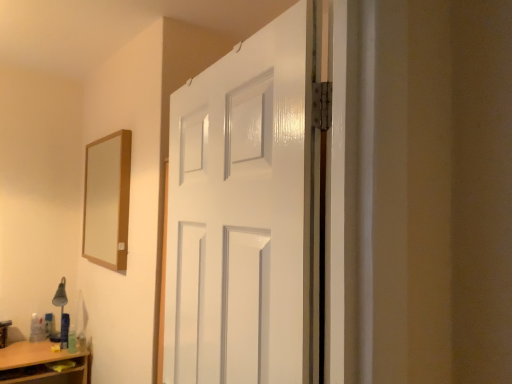
What do you see at coordinates (62, 312) in the screenshot? Image resolution: width=512 pixels, height=384 pixels. I see `matte silver table lamp at lower left` at bounding box center [62, 312].

Describe the element at coordinates (106, 200) in the screenshot. The height and width of the screenshot is (384, 512). I see `wooden-framed mirror at upper left` at that location.

Find the location of a particular element. The width and height of the screenshot is (512, 384). matte silver table lamp at lower left is located at coordinates (62, 312).

Could you tell me if matte silver table lamp at lower left is facing wooden-framed mirror at upper left?

No, matte silver table lamp at lower left is not turned towards wooden-framed mirror at upper left.

Does matte silver table lamp at lower left have a lesser width compared to wooden-framed mirror at upper left?

Incorrect, the width of matte silver table lamp at lower left is not less than that of wooden-framed mirror at upper left.

Locate an element on the screen. The width and height of the screenshot is (512, 384). mirror on the right of matte silver table lamp at lower left is located at coordinates (106, 200).

Can you tell me how much matte silver table lamp at lower left and wooden-framed mirror at upper left differ in facing direction?

They differ by 79.1 degrees in their facing directions.

Is white glossy door at center positioned with its back to wooden-framed mirror at upper left?

No.

Locate an element on the screen. The image size is (512, 384). mirror above the white glossy door at center (from the image's perspective) is located at coordinates (106, 200).

Can you confirm if white glossy door at center is smaller than wooden-framed mirror at upper left?

Actually, white glossy door at center might be larger than wooden-framed mirror at upper left.

How different are the orientations of wooden-framed mirror at upper left and matte silver table lamp at lower left in degrees?

The angle between the facing direction of wooden-framed mirror at upper left and the facing direction of matte silver table lamp at lower left is 79.1 degrees.

Could you tell me if wooden-framed mirror at upper left is turned towards matte silver table lamp at lower left?

No, wooden-framed mirror at upper left does not turn towards matte silver table lamp at lower left.

Considering the sizes of objects wooden-framed mirror at upper left and matte silver table lamp at lower left in the image provided, who is taller, wooden-framed mirror at upper left or matte silver table lamp at lower left?

With more height is wooden-framed mirror at upper left.

Is wooden-framed mirror at upper left wider or thinner than matte silver table lamp at lower left?

wooden-framed mirror at upper left is thinner than matte silver table lamp at lower left.

Is white glossy door at center bigger than matte silver table lamp at lower left?

Yes.

Considering the relative positions of white glossy door at center and matte silver table lamp at lower left in the image provided, is white glossy door at center to the left of matte silver table lamp at lower left from the viewer's perspective?

Incorrect, white glossy door at center is not on the left side of matte silver table lamp at lower left.

From a real-world perspective, which is physically below, white glossy door at center or matte silver table lamp at lower left?

matte silver table lamp at lower left is physically lower.

Considering the positions of objects white glossy door at center and matte silver table lamp at lower left in the image provided, who is in front, white glossy door at center or matte silver table lamp at lower left?

white glossy door at center.

Is matte silver table lamp at lower left next to white glossy door at center and touching it?

No, matte silver table lamp at lower left is not making contact with white glossy door at center.

Where is `table lamp below the white glossy door at center (from a real-world perspective)`? The height and width of the screenshot is (384, 512). table lamp below the white glossy door at center (from a real-world perspective) is located at coordinates (62, 312).

Is matte silver table lamp at lower left oriented away from white glossy door at center?

No, matte silver table lamp at lower left is not facing the opposite direction of white glossy door at center.

From a real-world perspective, relative to white glossy door at center, is matte silver table lamp at lower left vertically above or below?

matte silver table lamp at lower left is situated lower than white glossy door at center in the real world.

Is wooden-framed mirror at upper left thinner than white glossy door at center?

Indeed, wooden-framed mirror at upper left has a lesser width compared to white glossy door at center.

From the image's perspective, is wooden-framed mirror at upper left under white glossy door at center?

Actually, wooden-framed mirror at upper left appears above white glossy door at center in the image.

Is wooden-framed mirror at upper left taller than white glossy door at center?

Incorrect, the height of wooden-framed mirror at upper left is not larger of that of white glossy door at center.

In the scene shown: From a real-world perspective, which is physically above, wooden-framed mirror at upper left or white glossy door at center?

wooden-framed mirror at upper left, from a real-world perspective.

You are a GUI agent. You are given a task and a screenshot of the screen. Output one action in this format:
    pyautogui.click(x=<x>, y=<y>)
    Task: Click on the table lamp below the wooden-framed mirror at upper left (from the image's perspective)
    This screenshot has height=384, width=512.
    Given the screenshot: What is the action you would take?
    pyautogui.click(x=62, y=312)

You are a GUI agent. You are given a task and a screenshot of the screen. Output one action in this format:
    pyautogui.click(x=<x>, y=<y>)
    Task: Click on the door lying in front of the wooden-framed mirror at upper left
    Image resolution: width=512 pixels, height=384 pixels.
    Given the screenshot: What is the action you would take?
    (x=243, y=213)

Which object lies further to the anchor point matte silver table lamp at lower left, wooden-framed mirror at upper left or white glossy door at center?

white glossy door at center lies further to matte silver table lamp at lower left than the other object.

Considering their positions, is white glossy door at center positioned closer to wooden-framed mirror at upper left than matte silver table lamp at lower left?

matte silver table lamp at lower left is closer to wooden-framed mirror at upper left.

Based on their spatial positions, is white glossy door at center or wooden-framed mirror at upper left further from matte silver table lamp at lower left?

white glossy door at center is further to matte silver table lamp at lower left.

From the image, which object appears to be nearer to white glossy door at center, matte silver table lamp at lower left or wooden-framed mirror at upper left?

The object closer to white glossy door at center is wooden-framed mirror at upper left.

Estimate the real-world distances between objects in this image. Which object is closer to wooden-framed mirror at upper left, matte silver table lamp at lower left or white glossy door at center?

matte silver table lamp at lower left is positioned closer to the anchor wooden-framed mirror at upper left.

Estimate the real-world distances between objects in this image. Which object is closer to white glossy door at center, wooden-framed mirror at upper left or matte silver table lamp at lower left?

Based on the image, wooden-framed mirror at upper left appears to be nearer to white glossy door at center.

Locate an element on the screen. The image size is (512, 384). mirror positioned between white glossy door at center and matte silver table lamp at lower left from near to far is located at coordinates (106, 200).